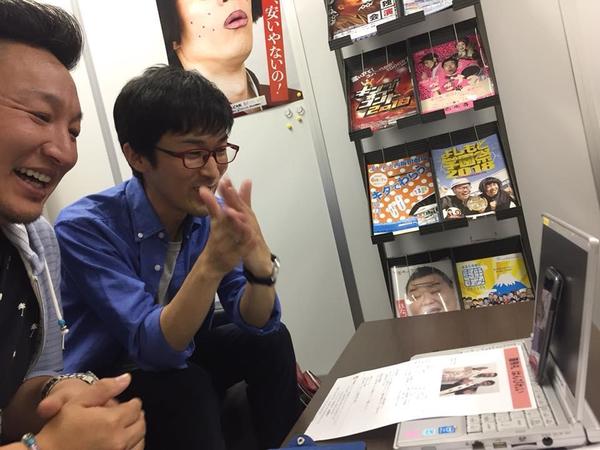
At what (x,y) coordinates should I click in order to perform the action: click on phone. Please return your answer as a coordinate pair (x, y). The height and width of the screenshot is (450, 600). Looking at the image, I should click on (543, 314).